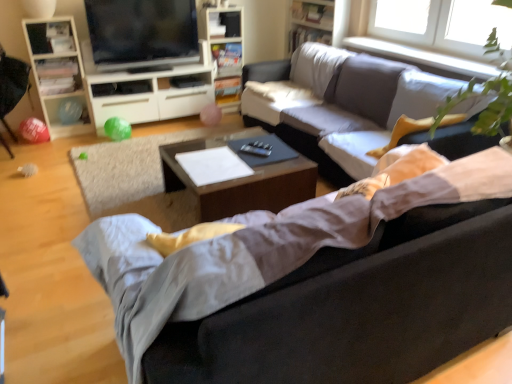
Question: Does wooden bookshelf at upper center, acting as the 1th bookshelf starting from the left, touch woodenwoodencoffee table at center?

Choices:
 (A) yes
 (B) no

Answer: (B)

Question: Is wooden bookshelf at upper center, acting as the 1th bookshelf starting from the left, to the right of woodenwoodencoffee table at center from the viewer's perspective?

Choices:
 (A) no
 (B) yes

Answer: (A)

Question: Does wooden bookshelf at upper center, acting as the 1th bookshelf starting from the left, have a larger size compared to woodenwoodencoffee table at center?

Choices:
 (A) no
 (B) yes

Answer: (A)

Question: Is wooden bookshelf at upper center, marked as the 2th bookshelf in a right-to-left arrangement, smaller than woodenwoodencoffee table at center?

Choices:
 (A) yes
 (B) no

Answer: (A)

Question: Is the position of wooden bookshelf at upper center, marked as the 2th bookshelf in a right-to-left arrangement, more distant than that of woodenwoodencoffee table at center?

Choices:
 (A) yes
 (B) no

Answer: (A)

Question: In the image, is matte black armchair at left positioned in front of or behind matte white cabinet at center left?

Choices:
 (A) front
 (B) behind

Answer: (A)

Question: From the image's perspective, is matte black armchair at left positioned above or below matte white cabinet at center left?

Choices:
 (A) below
 (B) above

Answer: (A)

Question: Is point (13, 67) positioned closer to the camera than point (142, 99)?

Choices:
 (A) closer
 (B) farther

Answer: (A)

Question: Would you say matte black armchair at left is to the left or to the right of matte white cabinet at center left in the picture?

Choices:
 (A) right
 (B) left

Answer: (B)

Question: From their relative heights in the image, would you say white wood cabinet at left is taller or shorter than soft gray fabric couch at center, arranged as the 1th studio couch when viewed from the back?

Choices:
 (A) short
 (B) tall

Answer: (B)

Question: From a real-world perspective, is white wood cabinet at left above or below soft gray fabric couch at center, the second studio couch in the front-to-back sequence?

Choices:
 (A) below
 (B) above

Answer: (B)

Question: Considering the positions of white wood cabinet at left and soft gray fabric couch at center, the second studio couch in the front-to-back sequence, in the image, is white wood cabinet at left bigger or smaller than soft gray fabric couch at center, the second studio couch in the front-to-back sequence,?

Choices:
 (A) small
 (B) big

Answer: (A)

Question: From the image's perspective, is white wood cabinet at left located above or below soft gray fabric couch at center, arranged as the 1th studio couch when viewed from the back?

Choices:
 (A) above
 (B) below

Answer: (A)

Question: Considering their positions, is wooden bookshelf at upper center, the second bookshelf viewed from the left, located in front of or behind soft gray fabric couch at center, the second studio couch in the front-to-back sequence?

Choices:
 (A) behind
 (B) front

Answer: (A)

Question: Which is correct: wooden bookshelf at upper center, the second bookshelf viewed from the left, is inside soft gray fabric couch at center, the second studio couch in the front-to-back sequence, or outside of it?

Choices:
 (A) inside
 (B) outside

Answer: (B)